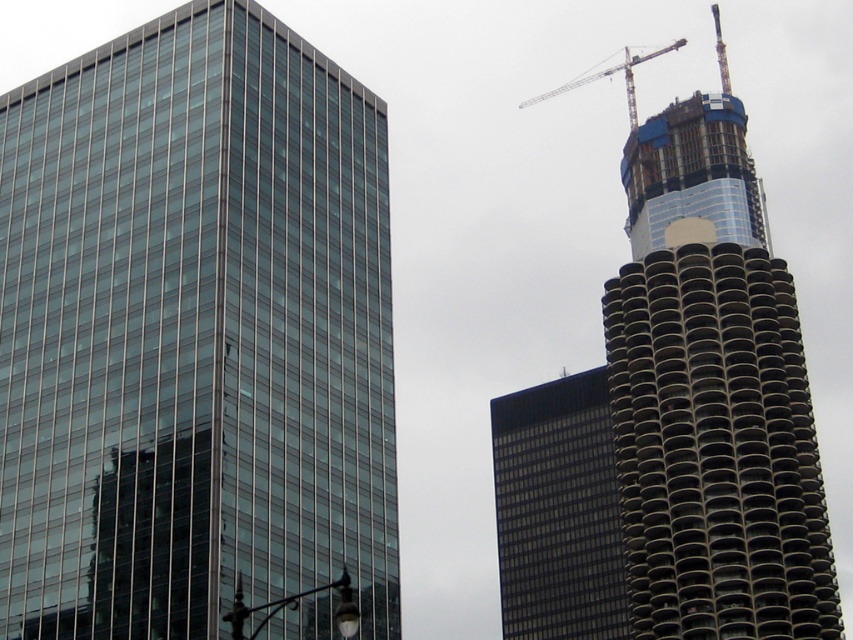
Question: Does glassy reflective skyscraper at left appear on the right side of matte glass skyscraper at center?

Choices:
 (A) yes
 (B) no

Answer: (B)

Question: Is matte glass skyscraper at center positioned before metallic gray crane at upper right?

Choices:
 (A) no
 (B) yes

Answer: (B)

Question: Can you confirm if glassy reflective skyscraper at left is smaller than metallic gray crane at upper right?

Choices:
 (A) yes
 (B) no

Answer: (A)

Question: Among these objects, which one is farthest from the camera?

Choices:
 (A) metallic gray crane at upper right
 (B) matte glass skyscraper at center
 (C) glassy reflective skyscraper at left
 (D) glassy concrete tower at upper right

Answer: (A)

Question: Which point is farther from the camera taking this photo?

Choices:
 (A) (724, 250)
 (B) (621, 64)
 (C) (84, 209)
 (D) (500, 396)

Answer: (B)

Question: Which object is positioned closest to the metallic gray crane at upper right?

Choices:
 (A) matte glass skyscraper at center
 (B) glassy reflective skyscraper at left
 (C) glassy concrete tower at upper right

Answer: (C)